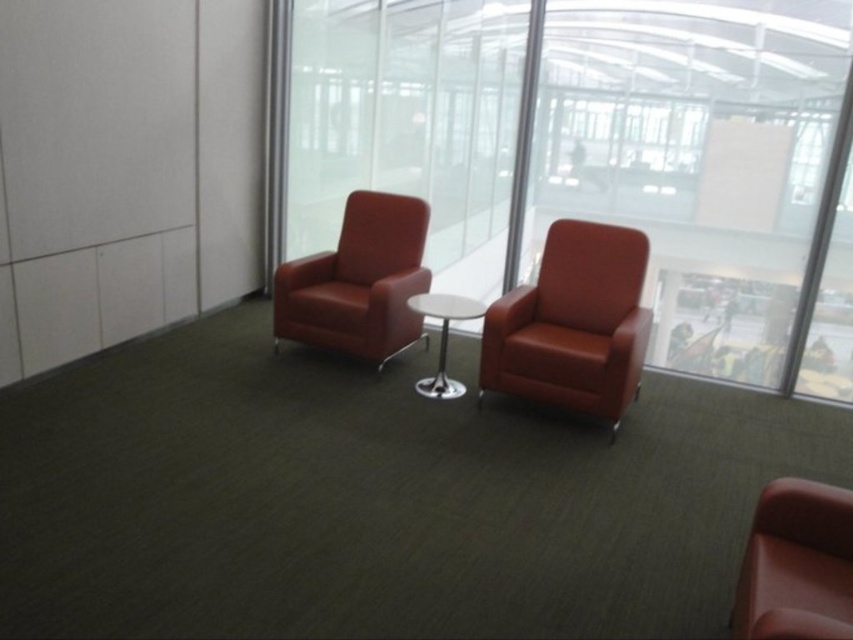
You are a customer in a waiting area and want to sit down. There is a suede leather armchair at center and a white glossy table at center. Which object is positioned higher from the floor?

The suede leather armchair at center is located above the white glossy table at center, so the suede leather armchair at center is higher from the floor.

You are a delivery robot that is 0.5 meters wide. You are standing at the point marked as point (x=827, y=593) and need to move to the other side of the room. There is a path between the two red armchairs facing each other. Can you pass through this path without hitting the chairs?

The path between the two red armchairs facing each other is 1.85 meters wide, so the delivery robot which is 0.5 meters wide can safely pass through the path between the two red armchairs facing each other as it is wide enough.

You are sitting on the suede leather armchair at center and want to place a book on the white glossy table at center. Can you reach the table without getting up?

The suede leather armchair at center is in front of the white glossy table at center, so you can reach the table without getting up.